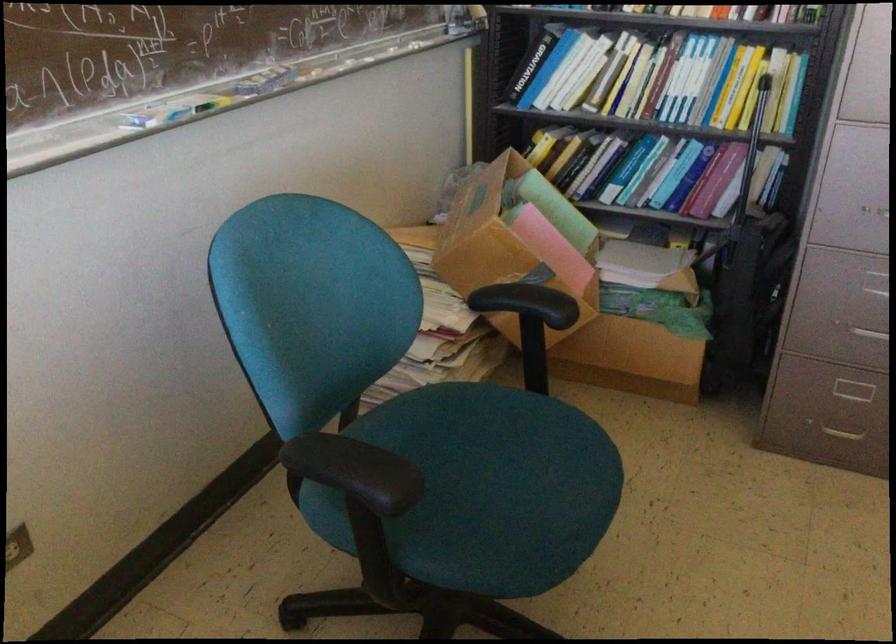
The location [583,77] corresponds to which object?

It refers to a white book.